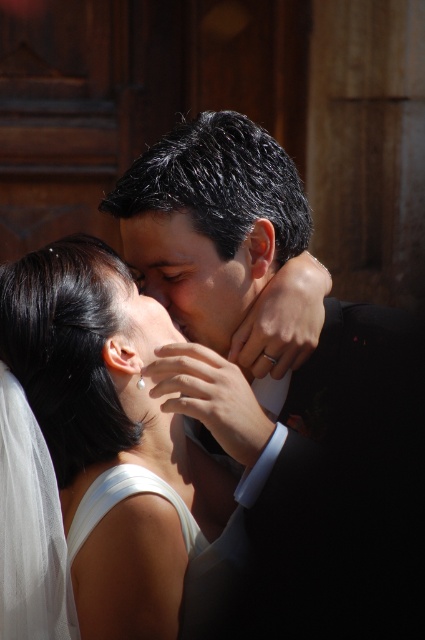
You are a photographer trying to capture a closeup shot of the smooth skin face at center without including the white satin dress at center in the frame. Based on the scene description, is it possible to do so?

The white satin dress at center is wider than the smooth skin face at center, so it might be challenging to capture the face without including the dress in the frame. However, by adjusting the camera angle or zoom level, it could be possible to focus solely on the face.

You are a photographer adjusting the focus on your camera. You need to ensure that both points, point (223, 435) and point (70, 516), are in focus. Since the camera can only focus on one point at a time, which point should you focus on to capture both points clearly?

You should focus on point (223, 435) because it is closer to the camera, and focusing on the closer point will ensure the farther point (70, 516) is also in focus.

You are standing in front of the couple and want to place a bouquet of flowers between the two points marked as point (76, 420) and point (234, 266). Which point should the bouquet be placed closer to in order to be closer to the viewer?

The bouquet should be placed closer to point (76, 420) because it is closer to the viewer than point (234, 266).